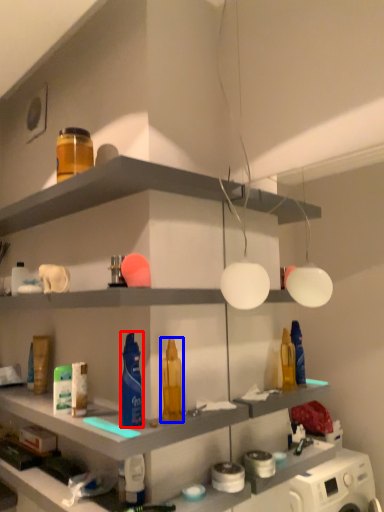
Question: Among these objects, which one is nearest to the camera, cleaning product (highlighted by a red box) or toiletry (highlighted by a blue box)?

Choices:
 (A) cleaning product
 (B) toiletry

Answer: (A)